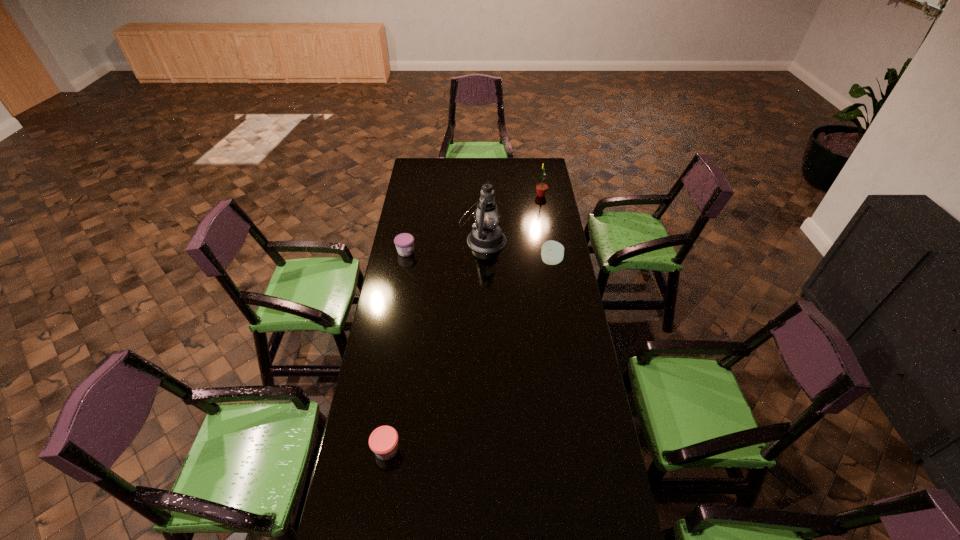
Where is `vacant region between the nearer jam and the farther jam`? vacant region between the nearer jam and the farther jam is located at coordinates (396, 350).

Find the location of a particular element. vacant region between the sunflower and the nearer jam is located at coordinates (464, 322).

This screenshot has height=540, width=960. I want to click on unoccupied area between the fourth shortest object and the farther jam, so click(x=473, y=223).

At what (x,y) coordinates should I click in order to perform the action: click on free space that is in between the apple and the fourth shortest object. Please return your answer as a coordinate pair (x, y). Looking at the image, I should click on (546, 228).

At what (x,y) coordinates should I click in order to perform the action: click on unoccupied position between the farther jam and the third object from right to left. Please return your answer as a coordinate pair (x, y). Looking at the image, I should click on (444, 246).

Image resolution: width=960 pixels, height=540 pixels. Identify the location of vacant area that lies between the farthest object and the farther jam. (473, 223).

Identify the location of object that stands as the third closest to the third object from right to left. (541, 188).

Image resolution: width=960 pixels, height=540 pixels. I want to click on object that stands as the closest to the nearer jam, so click(404, 242).

At what (x,y) coordinates should I click in order to perform the action: click on free space that satisfies the following two spatial constraints: 1. on the front side of the oil lamp; 2. on the left side of the third shortest object. Please return your answer as a coordinate pair (x, y). Looking at the image, I should click on (484, 261).

The height and width of the screenshot is (540, 960). In order to click on free space that satisfies the following two spatial constraints: 1. on the front side of the apple; 2. on the front label of the nearer jam in this screenshot , I will do `click(583, 449)`.